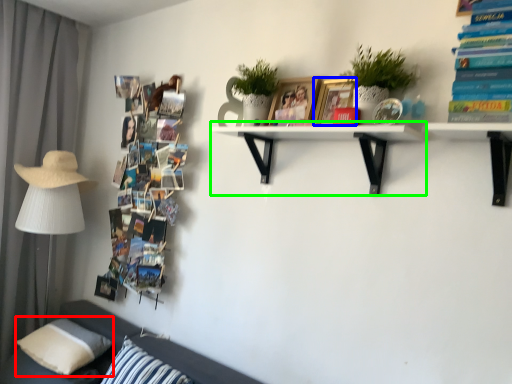
Question: Which is nearer to the pillow (highlighted by a red box)? picture frame (highlighted by a blue box) or shelf (highlighted by a green box).

Choices:
 (A) picture frame
 (B) shelf

Answer: (B)